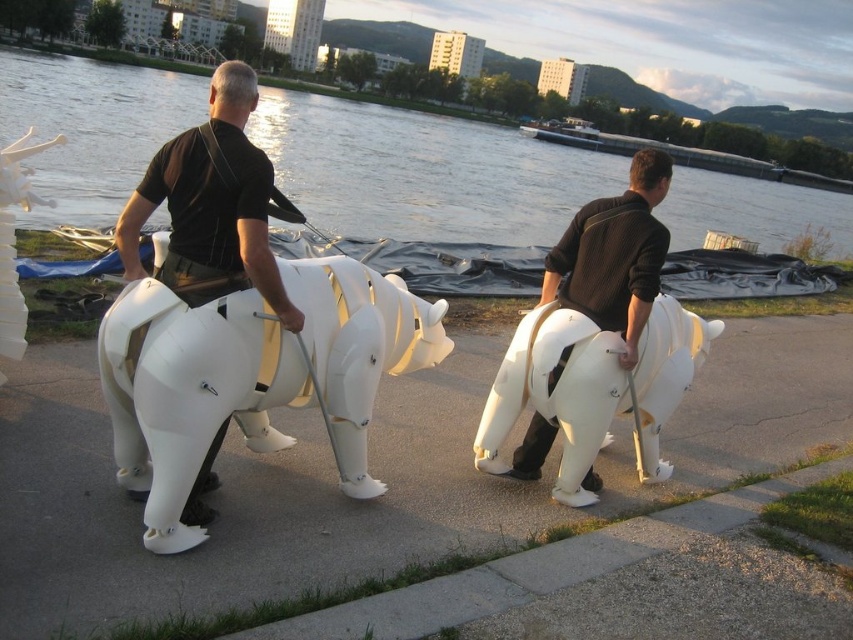
Question: Is transparent water at center further to camera compared to matte black sweater at right?

Choices:
 (A) no
 (B) yes

Answer: (A)

Question: Which point is closer to the camera taking this photo?

Choices:
 (A) (270, 496)
 (B) (582, 310)
 (C) (563, 480)
 (D) (262, 205)

Answer: (D)

Question: Can you confirm if transparent water at center is positioned below white matte mechanical horse at center?

Choices:
 (A) yes
 (B) no

Answer: (B)

Question: Which object is positioned farthest from the white plastic bear at center?

Choices:
 (A) white matte mechanical horse at center
 (B) white matte plastic sculpture at center

Answer: (A)

Question: Estimate the real-world distances between objects in this image. Which object is farther from the matte white robot at center?

Choices:
 (A) matte black sweater at right
 (B) white matte mechanical horse at center
 (C) white plastic bear at center

Answer: (B)

Question: Is white matte plastic sculpture at center further to the viewer compared to matte black sweater at right?

Choices:
 (A) no
 (B) yes

Answer: (A)